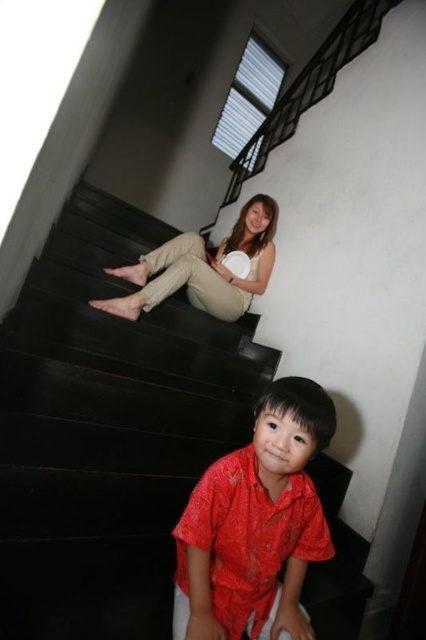
Question: Which of the following is the closest to the observer?

Choices:
 (A) matte red shirt at lower center
 (B) beige cotton pants at center
 (C) black glossy stairs at upper center

Answer: (C)

Question: Does black glossy stairs at upper center appear under matte red shirt at lower center?

Choices:
 (A) no
 (B) yes

Answer: (A)

Question: Which object is farther from the camera taking this photo?

Choices:
 (A) black glossy stairs at upper center
 (B) beige cotton pants at center
 (C) matte red shirt at lower center

Answer: (B)

Question: Does black glossy stairs at upper center lie behind matte red shirt at lower center?

Choices:
 (A) yes
 (B) no

Answer: (B)

Question: Which is nearer to the black glossy stairs at upper center?

Choices:
 (A) beige cotton pants at center
 (B) matte red shirt at lower center

Answer: (A)

Question: Does black glossy stairs at upper center come in front of matte red shirt at lower center?

Choices:
 (A) no
 (B) yes

Answer: (B)